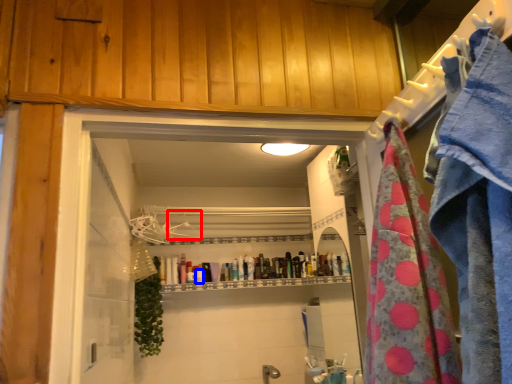
Question: Among these objects, which one is farthest to the camera, hanger (highlighted by a red box) or toiletry (highlighted by a blue box)?

Choices:
 (A) hanger
 (B) toiletry

Answer: (B)